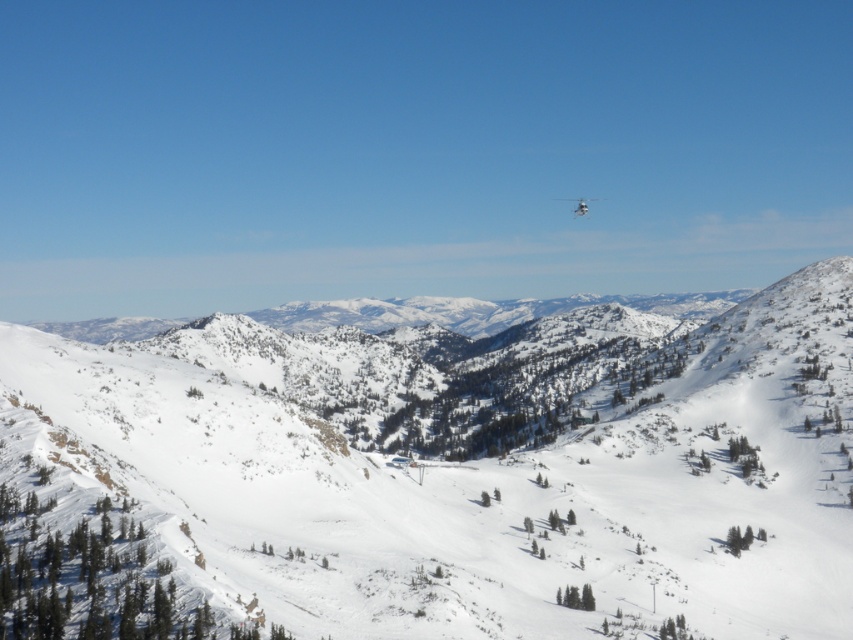
Who is more forward, (357, 376) or (577, 204)?

Point (357, 376)

Which is more to the left, white snow-covered mountain at center or white matte helicopter at upper center?

white snow-covered mountain at center

Find the location of a particular element. white snow-covered mountain at center is located at coordinates (436, 476).